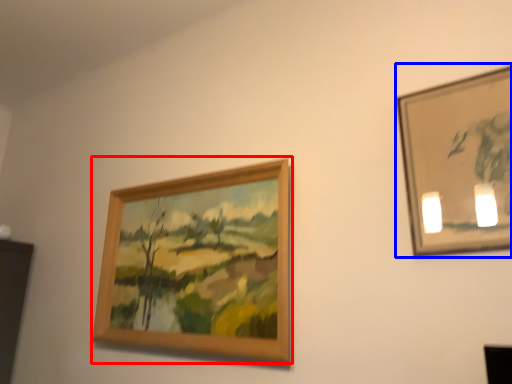
Question: Which point is further to the camera, picture frame (highlighted by a red box) or picture frame (highlighted by a blue box)?

Choices:
 (A) picture frame
 (B) picture frame

Answer: (A)